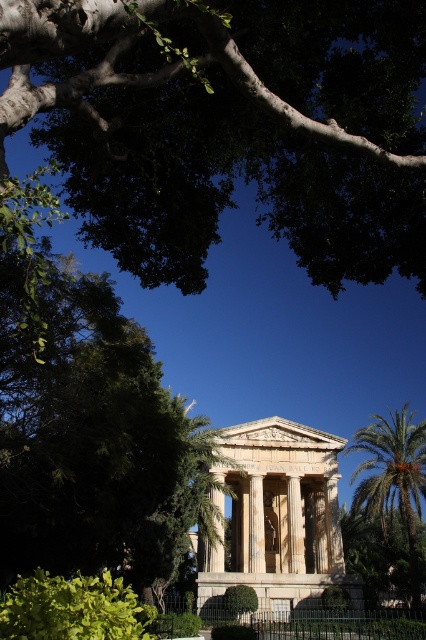
You are an architect examining the temple structure. You notice the green leafy tree at upper center and the green leafy palm at right. Which of these two trees has a larger overall size in the image?

The green leafy tree at upper center is larger in size than the green leafy palm at right.

You are an architect designing a new garden layout. You need to place a new statue exactly at the center of the image. Considering the green leafy tree at upper center, can you determine if the statue will be placed directly below the tree?

The green leafy tree at upper center is located at point 0.197 on the x axis and 0.538 on the y axis. Since the center of the image is at point 0.5 on both axes, the statue placed at the center will not be directly below the tree as the tree is positioned to the left and lower than the center.

You are an architect evaluating the structural integrity of the temple. Considering the green leafy tree at upper center and the green leafy hedge at lower left, which one might pose a greater risk to the temple due to its height?

The green leafy tree at upper center is much taller than the green leafy hedge at lower left, so it poses a greater risk to the temple due to its height.